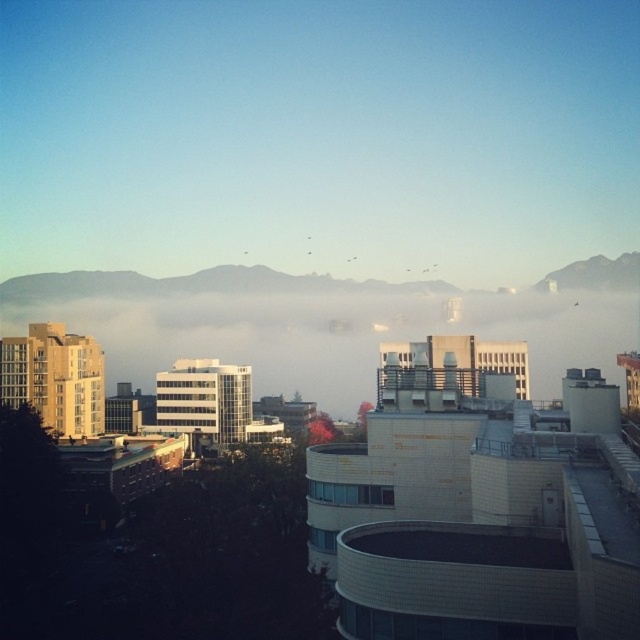
In the scene shown: You are a drone operator tasked with capturing aerial footage of the city. Your drone has a maximum flight range of 400 meters. If you are currently positioned at the camera location, can your drone safely fly through the white fluffy morning fog at center and return without exceeding its range limit?

The distance between the white fluffy morning fog at center and the camera is 411.27 meters. Since the drone can only fly up to 400 meters, it cannot safely reach the fog and return within its range limit. The flight would exceed the maximum allowed distance.

You are a drone operator tasked with capturing aerial footage of the white fluffy morning fog at center and the rocky gray mountain at upper right. The drone has a maximum flight range of 200 feet. Can you fly the drone from the fog to the mountain without exceeding its range?

The white fluffy morning fog at center and the rocky gray mountain at upper right are 219.41 feet apart. Since the drone can only fly up to 200 feet, it cannot reach the mountain from the fog without exceeding its range.

In the scene shown: You are an architect planning to build a new observation deck in the city. You want to ensure that the deck will have an unobstructed view of the rocky gray mountain at upper right. Given the current scene, will the white fluffy morning fog at center block the view of the mountain?

The white fluffy morning fog at center is much taller than the rocky gray mountain at upper right, so the fog would block the view of the mountain.